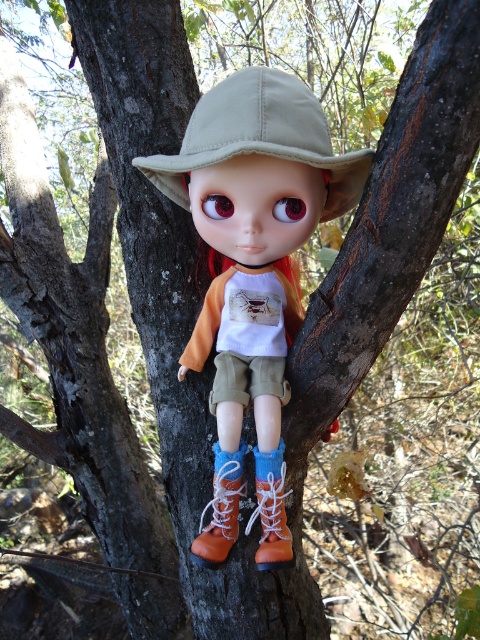
Question: Is matte khaki hat at center in front of orange suede boot at lower center?

Choices:
 (A) no
 (B) yes

Answer: (B)

Question: Which point is closer to the camera?

Choices:
 (A) (263, 92)
 (B) (282, 490)
 (C) (283, 355)
 (D) (213, 547)

Answer: (A)

Question: Which point is farther to the camera?

Choices:
 (A) (352, 156)
 (B) (230, 536)

Answer: (B)

Question: Does orange suede boot at lower center have a smaller size compared to brown suede boot at lower center?

Choices:
 (A) yes
 (B) no

Answer: (B)

Question: Which point is closer to the camera?

Choices:
 (A) (262, 513)
 (B) (220, 545)
 (C) (231, 148)

Answer: (C)

Question: From the image, what is the correct spatial relationship of matte khaki hat at center in relation to brown suede boot at lower center?

Choices:
 (A) right
 (B) left

Answer: (B)